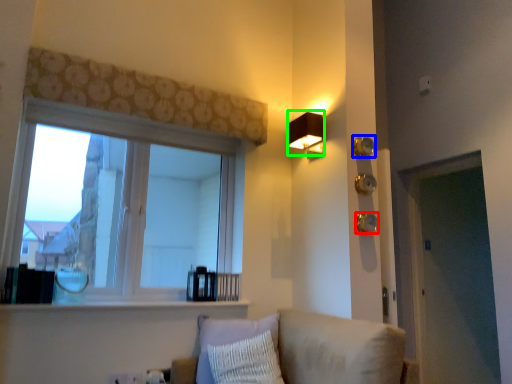
Question: Considering the real-world distances, which object is closest to knob (highlighted by a red box)? knob (highlighted by a blue box) or lamp (highlighted by a green box).

Choices:
 (A) knob
 (B) lamp

Answer: (A)